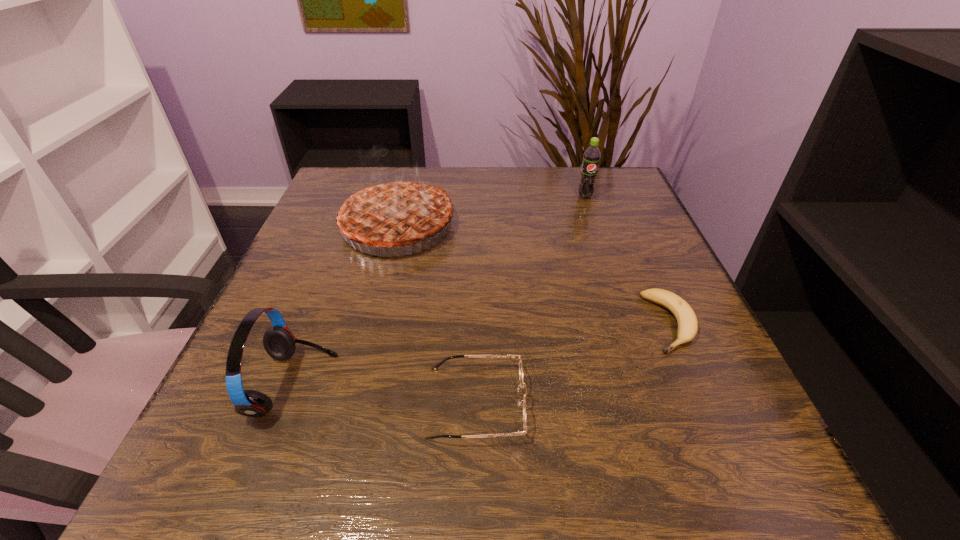
Identify the location of vacant point that satisfies the following two spatial constraints: 1. on the front label of the rightmost object; 2. on the left side of the soda. (629, 323).

You are a GUI agent. You are given a task and a screenshot of the screen. Output one action in this format:
    pyautogui.click(x=<x>, y=<y>)
    Task: Click on the vacant point that satisfies the following two spatial constraints: 1. on the front label of the fourth object from left to right; 2. with the microphone attached to the side of the headset
    The image size is (960, 540).
    Given the screenshot: What is the action you would take?
    pyautogui.click(x=650, y=385)

Where is `vacant region that satisfies the following two spatial constraints: 1. on the front label of the fourth object from left to right; 2. on the lenses of the fourth tallest object`? This screenshot has height=540, width=960. vacant region that satisfies the following two spatial constraints: 1. on the front label of the fourth object from left to right; 2. on the lenses of the fourth tallest object is located at coordinates (657, 403).